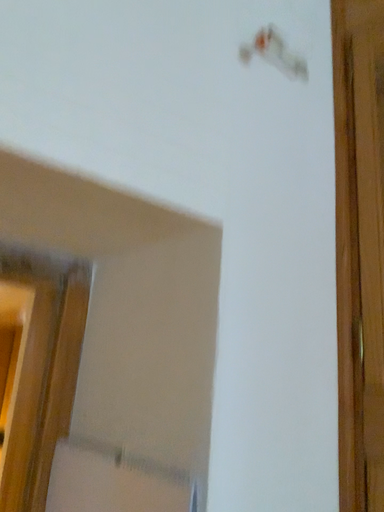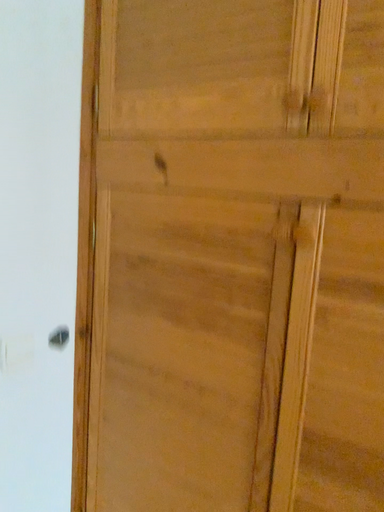
Question: How did the camera likely rotate when shooting the video?

Choices:
 (A) rotated upward
 (B) rotated downward

Answer: (B)